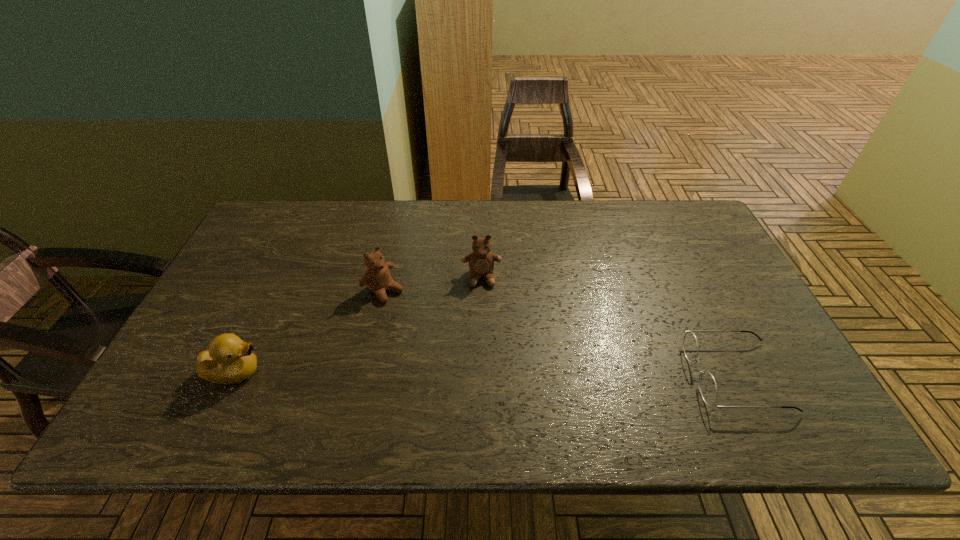
The height and width of the screenshot is (540, 960). I want to click on vacant region between the shortest object and the left teddy bear, so click(560, 333).

You are a GUI agent. You are given a task and a screenshot of the screen. Output one action in this format:
    pyautogui.click(x=<x>, y=<y>)
    Task: Click on the vacant area that lies between the rightmost object and the left teddy bear
    The height and width of the screenshot is (540, 960).
    Given the screenshot: What is the action you would take?
    pyautogui.click(x=560, y=333)

Locate an element on the screen. free space between the second object from left to right and the right teddy bear is located at coordinates [433, 284].

At what (x,y) coordinates should I click in order to perform the action: click on vacant point located between the shortest object and the duckling. Please return your answer as a coordinate pair (x, y). This screenshot has width=960, height=540. Looking at the image, I should click on (486, 374).

Locate an element on the screen. This screenshot has height=540, width=960. empty location between the spectacles and the right teddy bear is located at coordinates pos(609,327).

This screenshot has width=960, height=540. Find the location of `vacant space that's between the left teddy bear and the duckling`. vacant space that's between the left teddy bear and the duckling is located at coordinates (310, 331).

Identify the location of vacant space in between the third object from left to right and the left teddy bear. (433, 284).

Point out which object is positioned as the nearest to the third object from right to left. Please provide its 2D coordinates. Your answer should be formatted as a tuple, i.e. [(x, y)], where the tuple contains the x and y coordinates of a point satisfying the conditions above.

[(481, 261)]

Select which object is the third closest to the right teddy bear. Please provide its 2D coordinates. Your answer should be formatted as a tuple, i.e. [(x, y)], where the tuple contains the x and y coordinates of a point satisfying the conditions above.

[(229, 360)]

Where is `vacant space that satisfies the following two spatial constraints: 1. on the back side of the third object from left to right; 2. on the left side of the third object from right to left`? vacant space that satisfies the following two spatial constraints: 1. on the back side of the third object from left to right; 2. on the left side of the third object from right to left is located at coordinates (387, 278).